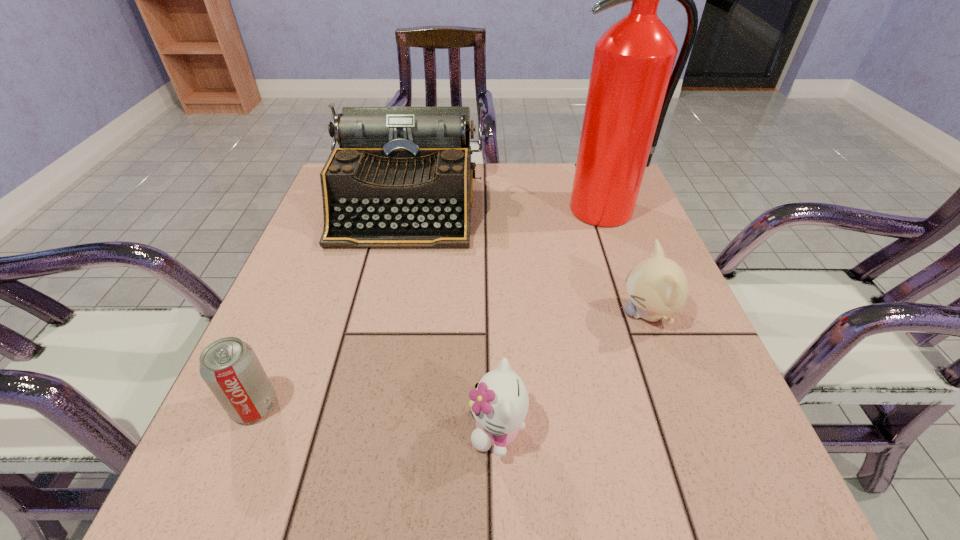
Find the location of `the tallest object`. the tallest object is located at coordinates (631, 85).

The image size is (960, 540). What are the coordinates of `the second tallest object` in the screenshot? It's located at (402, 178).

At what (x,y) coordinates should I click in order to perform the action: click on the third nearest object. Please return your answer as a coordinate pair (x, y). This screenshot has height=540, width=960. Looking at the image, I should click on (657, 286).

At what (x,y) coordinates should I click in order to perform the action: click on the right kitten. Please return your answer as a coordinate pair (x, y). Looking at the image, I should click on (657, 286).

At what (x,y) coordinates should I click in order to perform the action: click on soda can. Please return your answer as a coordinate pair (x, y). This screenshot has height=540, width=960. Looking at the image, I should click on (230, 368).

The width and height of the screenshot is (960, 540). I want to click on the left kitten, so click(499, 403).

Image resolution: width=960 pixels, height=540 pixels. Find the location of `free region located at the nozzle of the fire extinguisher`. free region located at the nozzle of the fire extinguisher is located at coordinates (615, 244).

The image size is (960, 540). I want to click on vacant space located 0.070m on the keyboard of the typewriter, so click(x=391, y=272).

You are a GUI agent. You are given a task and a screenshot of the screen. Output one action in this format:
    pyautogui.click(x=<x>, y=<y>)
    Task: Click on the vacant area located on the face of the farther kitten
    
    Given the screenshot: What is the action you would take?
    491,314

Image resolution: width=960 pixels, height=540 pixels. I want to click on free space located on the face of the farther kitten, so click(x=486, y=314).